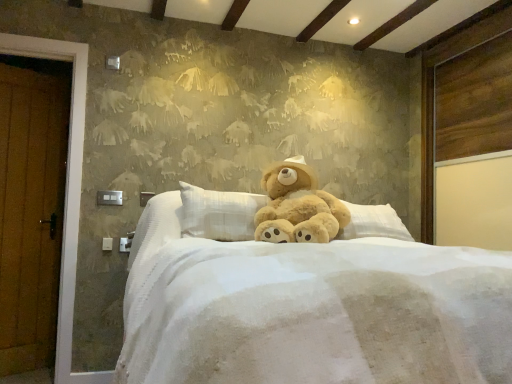
Question: Can you confirm if fuzzy beige teddy bear at center is shorter than soft white fabric bed at center?

Choices:
 (A) no
 (B) yes

Answer: (B)

Question: Is fuzzy beige teddy bear at center not near soft white fabric bed at center?

Choices:
 (A) yes
 (B) no

Answer: (B)

Question: Would you say soft white fabric bed at center is part of fuzzy beige teddy bear at center's contents?

Choices:
 (A) no
 (B) yes

Answer: (A)

Question: Can you confirm if fuzzy beige teddy bear at center is taller than soft white fabric bed at center?

Choices:
 (A) no
 (B) yes

Answer: (A)

Question: Considering the relative sizes of fuzzy beige teddy bear at center and soft white fabric bed at center in the image provided, is fuzzy beige teddy bear at center smaller than soft white fabric bed at center?

Choices:
 (A) yes
 (B) no

Answer: (A)

Question: Considering the relative positions of fuzzy beige teddy bear at center and soft white fabric bed at center in the image provided, is fuzzy beige teddy bear at center in front of soft white fabric bed at center?

Choices:
 (A) no
 (B) yes

Answer: (A)

Question: Can you confirm if soft white fabric bed at center is bigger than fuzzy beige teddy bear at center?

Choices:
 (A) yes
 (B) no

Answer: (A)

Question: From the image's perspective, would you say soft white fabric bed at center is shown under fuzzy beige teddy bear at center?

Choices:
 (A) no
 (B) yes

Answer: (B)

Question: From a real-world perspective, does soft white fabric bed at center stand above fuzzy beige teddy bear at center?

Choices:
 (A) no
 (B) yes

Answer: (A)

Question: Is soft white fabric bed at center completely or partially outside of fuzzy beige teddy bear at center?

Choices:
 (A) yes
 (B) no

Answer: (A)

Question: Does soft white fabric bed at center have a lesser height compared to fuzzy beige teddy bear at center?

Choices:
 (A) no
 (B) yes

Answer: (A)

Question: Does soft white fabric bed at center have a lesser width compared to fuzzy beige teddy bear at center?

Choices:
 (A) yes
 (B) no

Answer: (B)

Question: Would you say soft white fabric bed at center is inside or outside fuzzy beige teddy bear at center?

Choices:
 (A) outside
 (B) inside

Answer: (A)